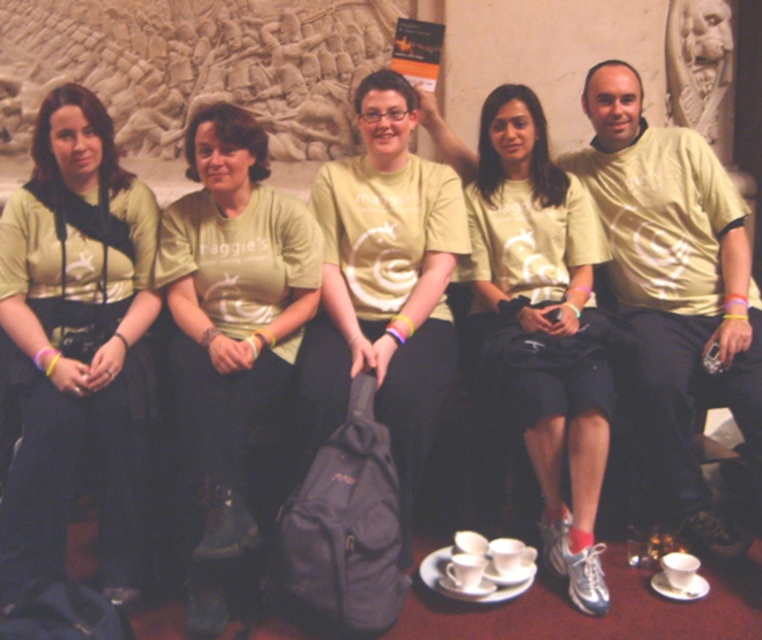
Question: Does matte green t-shirt at center have a lesser width compared to matte yellow t-shirt at center?

Choices:
 (A) yes
 (B) no

Answer: (A)

Question: Which object is positioned closest to the matte yellow shirt at left?

Choices:
 (A) white ceramic saucer at lower right
 (B) matte green t-shirt at center
 (C) white ceramic saucer at lower center

Answer: (B)

Question: Based on their relative distances, which object is farther from the light yellow cotton t-shirt at right?

Choices:
 (A) white ceramic saucer at lower center
 (B) matte yellow shirt at left
 (C) white ceramic saucer at lower right

Answer: (B)

Question: Is light yellow cotton t-shirt at right thinner than matte yellow t-shirt at center?

Choices:
 (A) no
 (B) yes

Answer: (B)

Question: Which point is farther to the camera?

Choices:
 (A) white ceramic saucer at lower right
 (B) matte yellow t-shirt at center

Answer: (A)

Question: Does matte yellow shirt at left appear over matte yellow t-shirt at center?

Choices:
 (A) yes
 (B) no

Answer: (B)